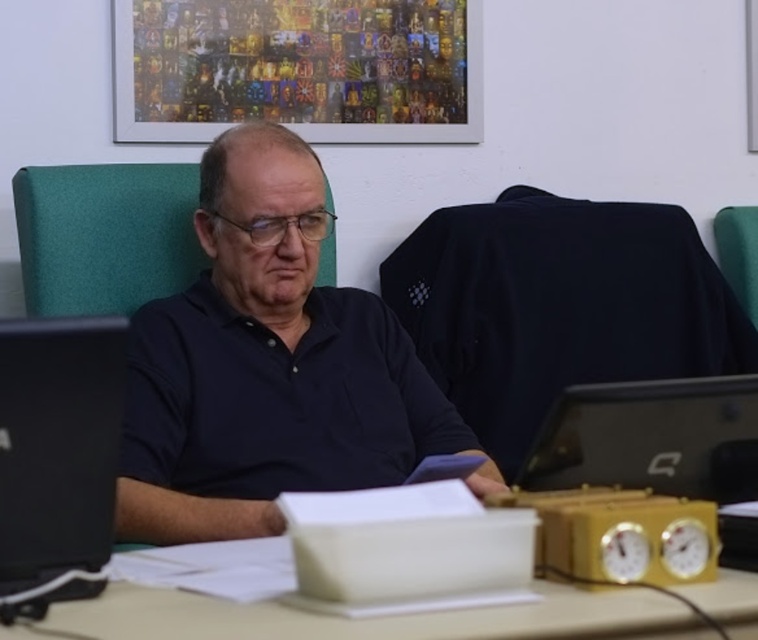
Question: Can you confirm if yellow plastic computer desk at center is thinner than black glossy laptop at right?

Choices:
 (A) no
 (B) yes

Answer: (A)

Question: Which object is closer to the camera taking this photo?

Choices:
 (A) black glossy laptop at right
 (B) green fabric chair at center
 (C) dark blue shirt at center
 (D) yellow plastic computer desk at center

Answer: (D)

Question: Among these points, which one is nearest to the camera?

Choices:
 (A) [362, 618]
 (B) [58, 477]
 (C) [622, 468]
 (D) [149, 436]

Answer: (A)

Question: Which object is closer to the camera taking this photo?

Choices:
 (A) black glossy laptop at left
 (B) black glossy laptop at right

Answer: (A)

Question: Is black glossy laptop at left in front of green fabric chair at center?

Choices:
 (A) yes
 (B) no

Answer: (A)

Question: Considering the relative positions of black glossy laptop at left and yellow plastic computer desk at center in the image provided, where is black glossy laptop at left located with respect to yellow plastic computer desk at center?

Choices:
 (A) above
 (B) below

Answer: (A)